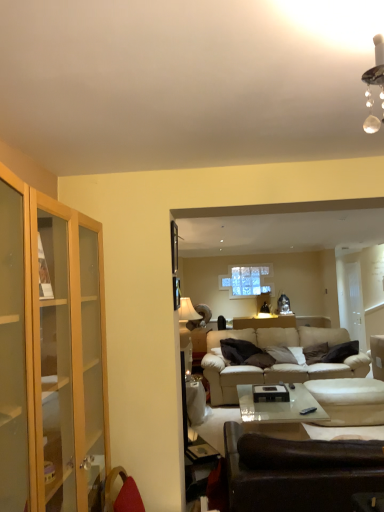
Question: Is dark gray fabric pillow at center positioned far away from leather couch at lower right, which ranks as the 1th studio couch in front-to-back order?

Choices:
 (A) yes
 (B) no

Answer: (A)

Question: Is dark gray fabric pillow at center shorter than leather couch at lower right, which ranks as the second studio couch in back-to-front order?

Choices:
 (A) yes
 (B) no

Answer: (A)

Question: Is dark gray fabric pillow at center bigger than leather couch at lower right, which ranks as the second studio couch in back-to-front order?

Choices:
 (A) yes
 (B) no

Answer: (B)

Question: Considering the relative sizes of dark gray fabric pillow at center and leather couch at lower right, which ranks as the 1th studio couch in front-to-back order, in the image provided, is dark gray fabric pillow at center taller than leather couch at lower right, which ranks as the 1th studio couch in front-to-back order,?

Choices:
 (A) yes
 (B) no

Answer: (B)

Question: From a real-world perspective, is dark gray fabric pillow at center physically above leather couch at lower right, which ranks as the 1th studio couch in front-to-back order?

Choices:
 (A) no
 (B) yes

Answer: (B)

Question: Would you say leather couch at lower right, which ranks as the second studio couch in back-to-front order, is inside or outside beige fabric armchair at right?

Choices:
 (A) outside
 (B) inside

Answer: (A)

Question: Is leather couch at lower right, which ranks as the 1th studio couch in front-to-back order, wider or thinner than beige fabric armchair at right?

Choices:
 (A) wide
 (B) thin

Answer: (A)

Question: Considering the positions of point (258, 437) and point (372, 350), is point (258, 437) closer or farther from the camera than point (372, 350)?

Choices:
 (A) closer
 (B) farther

Answer: (A)

Question: From the image's perspective, is leather couch at lower right, which ranks as the second studio couch in back-to-front order, located above or below beige fabric armchair at right?

Choices:
 (A) above
 (B) below

Answer: (A)

Question: Would you say dark gray fabric pillow at center is to the left or to the right of beige fabric armchair at right in the picture?

Choices:
 (A) right
 (B) left

Answer: (B)

Question: Is dark gray fabric pillow at center bigger or smaller than beige fabric armchair at right?

Choices:
 (A) big
 (B) small

Answer: (B)

Question: Looking at their shapes, would you say dark gray fabric pillow at center is wider or thinner than beige fabric armchair at right?

Choices:
 (A) thin
 (B) wide

Answer: (A)

Question: From the image's perspective, is dark gray fabric pillow at center positioned above or below beige fabric armchair at right?

Choices:
 (A) below
 (B) above

Answer: (B)

Question: From the image's perspective, is dark gray fabric pillow at center above or below beige leather couch at center, the first studio couch when ordered from back to front?

Choices:
 (A) above
 (B) below

Answer: (A)

Question: Looking at the image, does dark gray fabric pillow at center seem bigger or smaller compared to beige leather couch at center, the first studio couch when ordered from back to front?

Choices:
 (A) small
 (B) big

Answer: (A)